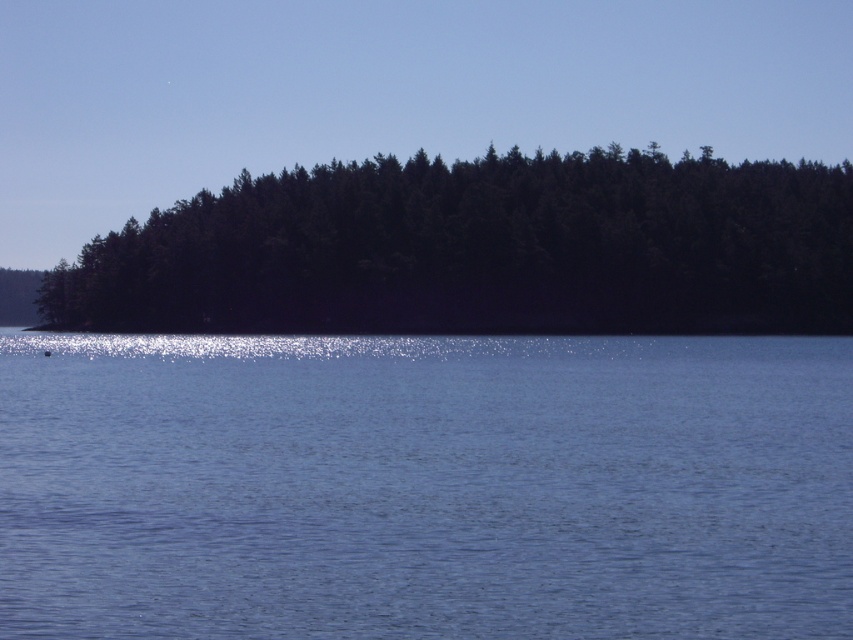
Question: Is the position of blue liquid water at center less distant than that of dark green forest at center?

Choices:
 (A) no
 (B) yes

Answer: (B)

Question: Is blue liquid water at center in front of dark green forest at center?

Choices:
 (A) yes
 (B) no

Answer: (A)

Question: Which point is closer to the camera?

Choices:
 (A) (148, 248)
 (B) (259, 356)

Answer: (B)

Question: Which object is closer to the camera taking this photo?

Choices:
 (A) blue liquid water at center
 (B) dark green forest at center

Answer: (A)

Question: Which point is closer to the camera taking this photo?

Choices:
 (A) (523, 522)
 (B) (575, 308)

Answer: (A)

Question: Is blue liquid water at center smaller than dark green forest at center?

Choices:
 (A) yes
 (B) no

Answer: (A)